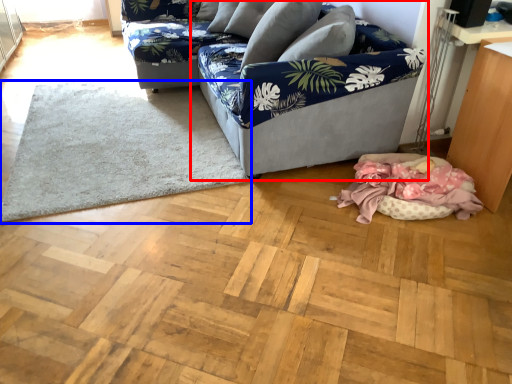
Question: Which of the following is the farthest to the observer, studio couch (highlighted by a red box) or mat (highlighted by a blue box)?

Choices:
 (A) studio couch
 (B) mat

Answer: (B)